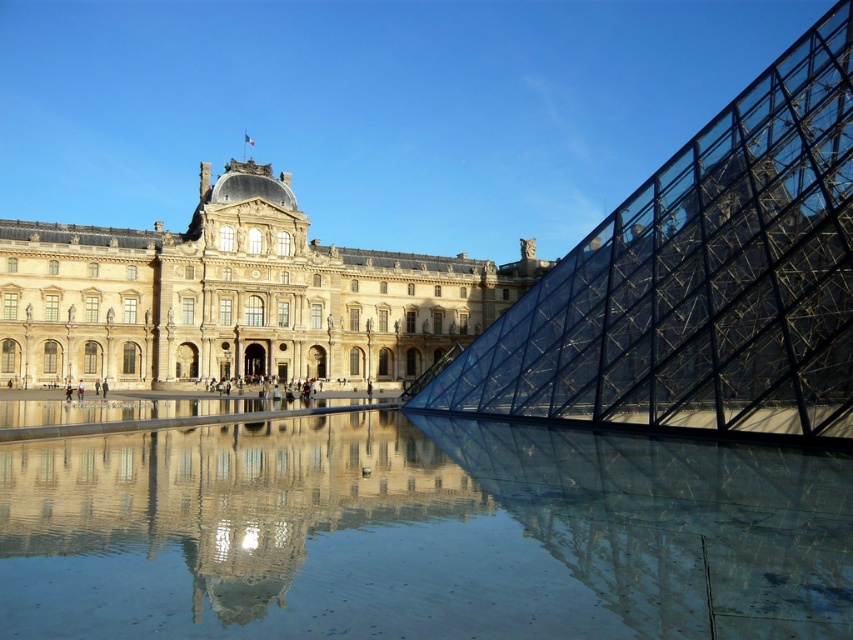
Question: Does transparent glass water at center have a larger size compared to beige stone palace at center?

Choices:
 (A) yes
 (B) no

Answer: (B)

Question: Does transparent glass water at center appear over beige stone palace at center?

Choices:
 (A) yes
 (B) no

Answer: (B)

Question: Is transparent glass water at center below beige stone palace at center?

Choices:
 (A) yes
 (B) no

Answer: (A)

Question: Which of the following is the closest to the observer?

Choices:
 (A) transparent glass water at center
 (B) beige stone palace at center

Answer: (A)

Question: Which object appears closest to the camera in this image?

Choices:
 (A) beige stone palace at center
 (B) transparent glass water at center

Answer: (B)